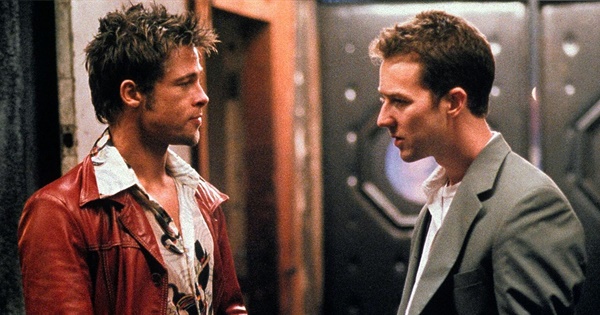
Locate an element on the screen. This screenshot has width=600, height=315. doorway is located at coordinates [x=226, y=149].